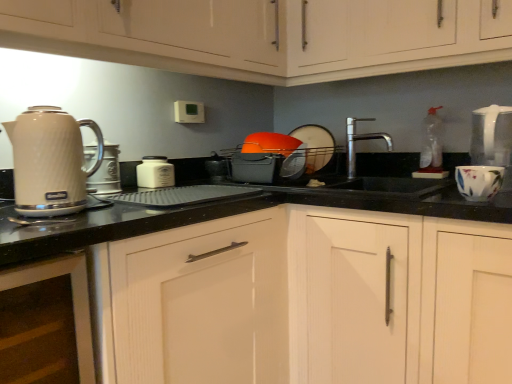
Where is `vacant space situated on the left part of floral ceramic mug at right`? vacant space situated on the left part of floral ceramic mug at right is located at coordinates (413, 191).